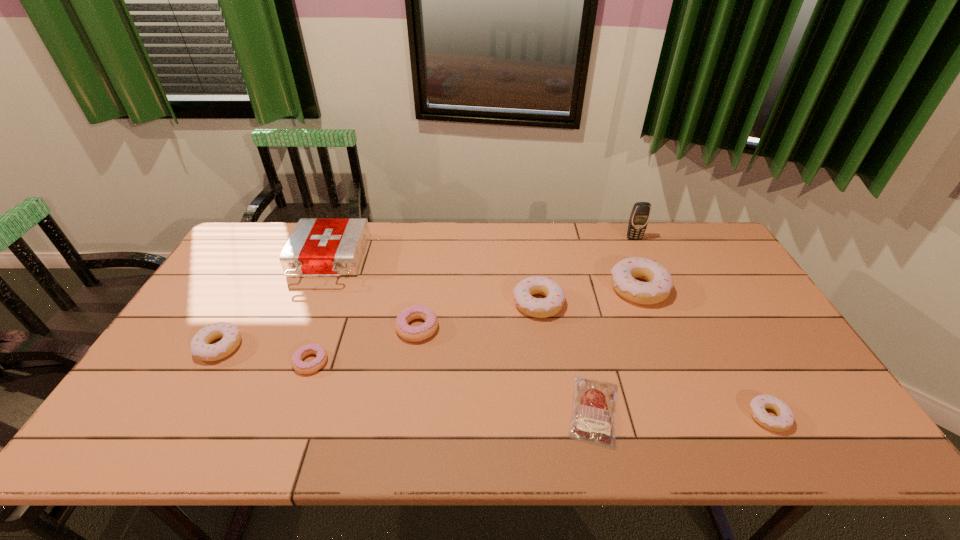
This screenshot has height=540, width=960. Find the location of `vacant area that lies between the third biggest white doughnut and the fifth shortest doughnut`. vacant area that lies between the third biggest white doughnut and the fifth shortest doughnut is located at coordinates click(378, 325).

You are a GUI agent. You are given a task and a screenshot of the screen. Output one action in this format:
    pyautogui.click(x=<x>, y=<y>)
    Task: Click on the vacant space that is in between the fourth tallest object and the red first-aid kit
    The width and height of the screenshot is (960, 540).
    Given the screenshot: What is the action you would take?
    pyautogui.click(x=433, y=282)

Find the location of `free space between the bigger pink doughnut and the nearest doughnut`. free space between the bigger pink doughnut and the nearest doughnut is located at coordinates (592, 372).

This screenshot has width=960, height=540. Find the location of `vacant area that lies between the leftmost doughnut and the cellular telephone`. vacant area that lies between the leftmost doughnut and the cellular telephone is located at coordinates (426, 293).

Locate an element on the screen. object that is the fourth closest to the shortest object is located at coordinates pos(410,333).

This screenshot has height=540, width=960. Identify the location of object that is the nearest to the fifth doughnut from right to left. (200, 346).

Image resolution: width=960 pixels, height=540 pixels. I want to click on doughnut that is the nearest to the second doughnut from left to right, so click(200, 346).

Where is `the fourth closest doughnut relative to the farther pink doughnut`? This screenshot has height=540, width=960. the fourth closest doughnut relative to the farther pink doughnut is located at coordinates (657, 289).

Select which white doughnut appears as the closest to the red first-aid kit. Please provide its 2D coordinates. Your answer should be formatted as a tuple, i.e. [(x, y)], where the tuple contains the x and y coordinates of a point satisfying the conditions above.

[(200, 346)]

Where is `the third closest white doughnut to the leftmost white doughnut`? The image size is (960, 540). the third closest white doughnut to the leftmost white doughnut is located at coordinates (785, 417).